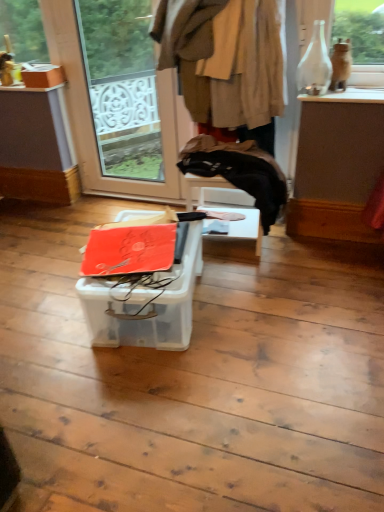
This screenshot has height=512, width=384. Describe the element at coordinates (42, 75) in the screenshot. I see `matte cardboard box at upper left, marked as the first cardboard box in a left-to-right arrangement` at that location.

Describe the element at coordinates (348, 96) in the screenshot. I see `white glossy vase at upper right` at that location.

Locate an element on the screen. orange matte cardboard box at center, the second cardboard box in the back-to-front sequence is located at coordinates (146, 300).

Is brown woolen coat at upper center not close to matte cardboard box at upper left, positioned as the 2th cardboard box in front-to-back order?

Yes, brown woolen coat at upper center and matte cardboard box at upper left, positioned as the 2th cardboard box in front-to-back order, are quite far apart.

From the image's perspective, is brown woolen coat at upper center below matte cardboard box at upper left, the 1th cardboard box in the back-to-front sequence?

Yes.

Considering the positions of points (213, 33) and (34, 73), is point (213, 33) farther from camera compared to point (34, 73)?

That is False.

Between brown woolen coat at upper center and matte cardboard box at upper left, marked as the first cardboard box in a left-to-right arrangement, which one appears on the left side from the viewer's perspective?

Positioned to the left is matte cardboard box at upper left, marked as the first cardboard box in a left-to-right arrangement.

Based on the photo, which object is wider, orange matte cardboard box at center, the second cardboard box in the back-to-front sequence, or white glossy vase at upper right?

orange matte cardboard box at center, the second cardboard box in the back-to-front sequence.

Is white glossy vase at upper right inside orange matte cardboard box at center, the second cardboard box viewed from the top?

No, white glossy vase at upper right is not surrounded by orange matte cardboard box at center, the second cardboard box viewed from the top.

Are orange matte cardboard box at center, positioned as the second cardboard box in left-to-right order, and white glossy vase at upper right far apart?

Yes, orange matte cardboard box at center, positioned as the second cardboard box in left-to-right order, and white glossy vase at upper right are located far from each other.

Is orange matte cardboard box at center, placed as the 1th cardboard box when sorted from right to left, oriented towards white glossy vase at upper right?

No, orange matte cardboard box at center, placed as the 1th cardboard box when sorted from right to left, is not oriented towards white glossy vase at upper right.

Which object is thinner, matte cardboard box at upper left, marked as the 2th cardboard box in a right-to-left arrangement, or brown woolen coat at upper center?

Thinner between the two is matte cardboard box at upper left, marked as the 2th cardboard box in a right-to-left arrangement.

From the image's perspective, between matte cardboard box at upper left, marked as the 1th cardboard box in a top-to-bottom arrangement, and brown woolen coat at upper center, who is located below?

brown woolen coat at upper center is shown below in the image.

Considering the positions of objects matte cardboard box at upper left, marked as the 1th cardboard box in a top-to-bottom arrangement, and brown woolen coat at upper center in the image provided, who is behind, matte cardboard box at upper left, marked as the 1th cardboard box in a top-to-bottom arrangement, or brown woolen coat at upper center?

Positioned behind is matte cardboard box at upper left, marked as the 1th cardboard box in a top-to-bottom arrangement.

Consider the image. Is matte cardboard box at upper left, positioned as the 2th cardboard box in front-to-back order, facing towards brown woolen coat at upper center?

No, matte cardboard box at upper left, positioned as the 2th cardboard box in front-to-back order, is not aimed at brown woolen coat at upper center.

Can you confirm if brown woolen coat at upper center is bigger than transparent glass door at upper left?

Correct, brown woolen coat at upper center is larger in size than transparent glass door at upper left.

Which object is wider, brown woolen coat at upper center or transparent glass door at upper left?

With larger width is brown woolen coat at upper center.

The height and width of the screenshot is (512, 384). Find the location of `clothing above the transparent glass door at upper left (from a real-world perspective)`. clothing above the transparent glass door at upper left (from a real-world perspective) is located at coordinates (224, 58).

How distant is brown woolen coat at upper center from transparent glass door at upper left?

A distance of 6.04 feet exists between brown woolen coat at upper center and transparent glass door at upper left.

Is transparent glass door at upper left in front of matte cardboard box at upper left, positioned as the 2th cardboard box in front-to-back order?

Yes, transparent glass door at upper left is closer to the camera.

In the scene shown: Looking at their sizes, would you say transparent glass door at upper left is wider or thinner than matte cardboard box at upper left, marked as the first cardboard box in a left-to-right arrangement?

Considering their sizes, transparent glass door at upper left looks slimmer than matte cardboard box at upper left, marked as the first cardboard box in a left-to-right arrangement.

Find the location of a particular element. cardboard box above the transparent glass door at upper left (from a real-world perspective) is located at coordinates (42, 75).

From a real-world perspective, is transparent glass door at upper left physically located above or below matte cardboard box at upper left, positioned as the 2th cardboard box in front-to-back order?

transparent glass door at upper left is below matte cardboard box at upper left, positioned as the 2th cardboard box in front-to-back order.

Where is `window sill in front of the transparent glass door at upper left`? window sill in front of the transparent glass door at upper left is located at coordinates (x=348, y=96).

Is white glossy vase at upper right not near transparent glass door at upper left?

Yes.

Could transparent glass door at upper left be considered to be inside white glossy vase at upper right?

No.

Does white glossy vase at upper right lie in front of transparent glass door at upper left?

That is True.

Considering the positions of objects transparent glass door at upper left and orange matte cardboard box at center, the second cardboard box in the back-to-front sequence, in the image provided, who is more to the left, transparent glass door at upper left or orange matte cardboard box at center, the second cardboard box in the back-to-front sequence,?

transparent glass door at upper left is more to the left.

Is transparent glass door at upper left not near orange matte cardboard box at center, which is the 1th cardboard box in bottom-to-top order?

Yes.

From the image's perspective, is transparent glass door at upper left above or below orange matte cardboard box at center, the second cardboard box viewed from the top?

transparent glass door at upper left is above orange matte cardboard box at center, the second cardboard box viewed from the top.

From a real-world perspective, is transparent glass door at upper left physically above orange matte cardboard box at center, acting as the first cardboard box starting from the front?

Yes, from a real-world perspective, transparent glass door at upper left is on top of orange matte cardboard box at center, acting as the first cardboard box starting from the front.

You are a GUI agent. You are given a task and a screenshot of the screen. Output one action in this format:
    pyautogui.click(x=<x>, y=<y>)
    Task: Click on the 2nd cardboard box to the left of the brown woolen coat at upper center, starting your count from the anchor
    
    Given the screenshot: What is the action you would take?
    pyautogui.click(x=42, y=75)

Locate an element on the screen. window sill lying behind the orange matte cardboard box at center, the second cardboard box viewed from the top is located at coordinates (348, 96).

Estimate the real-world distances between objects in this image. Which object is further from brown woolen coat at upper center, orange matte cardboard box at center, which is the 1th cardboard box in bottom-to-top order, or transparent glass door at upper left?

transparent glass door at upper left.

From the picture: Considering their positions, is orange matte cardboard box at center, which is the 1th cardboard box in bottom-to-top order, positioned further to brown woolen coat at upper center than white glossy vase at upper right?

The object further to brown woolen coat at upper center is orange matte cardboard box at center, which is the 1th cardboard box in bottom-to-top order.

From the image, which object appears to be nearer to matte cardboard box at upper left, marked as the first cardboard box in a left-to-right arrangement, white glossy vase at upper right or brown woolen coat at upper center?

brown woolen coat at upper center lies closer to matte cardboard box at upper left, marked as the first cardboard box in a left-to-right arrangement, than the other object.

Based on their spatial positions, is brown woolen coat at upper center or transparent glass door at upper left closer to matte cardboard box at upper left, positioned as the 2th cardboard box in front-to-back order?

brown woolen coat at upper center lies closer to matte cardboard box at upper left, positioned as the 2th cardboard box in front-to-back order, than the other object.

When comparing their distances from orange matte cardboard box at center, the second cardboard box in the back-to-front sequence, does matte cardboard box at upper left, marked as the 2th cardboard box in a right-to-left arrangement, or brown woolen coat at upper center seem closer?

brown woolen coat at upper center is positioned closer to the anchor orange matte cardboard box at center, the second cardboard box in the back-to-front sequence.

Which object lies further to the anchor point white glossy vase at upper right, brown woolen coat at upper center or orange matte cardboard box at center, the second cardboard box viewed from the top?

orange matte cardboard box at center, the second cardboard box viewed from the top, lies further to white glossy vase at upper right than the other object.

Which object lies nearer to the anchor point white glossy vase at upper right, matte cardboard box at upper left, positioned as the 2th cardboard box in front-to-back order, or orange matte cardboard box at center, which is the 1th cardboard box in bottom-to-top order?

orange matte cardboard box at center, which is the 1th cardboard box in bottom-to-top order, is positioned closer to the anchor white glossy vase at upper right.

Which object lies nearer to the anchor point brown woolen coat at upper center, transparent glass door at upper left or orange matte cardboard box at center, which is the 1th cardboard box in bottom-to-top order?

The object closer to brown woolen coat at upper center is orange matte cardboard box at center, which is the 1th cardboard box in bottom-to-top order.

In order to click on window sill between brown woolen coat at upper center and orange matte cardboard box at center, acting as the first cardboard box starting from the front, in the vertical direction in this screenshot , I will do `click(348, 96)`.

Find the location of a particular element. The width and height of the screenshot is (384, 512). window screen between matte cardboard box at upper left, the second cardboard box when ordered from bottom to top, and white glossy vase at upper right from left to right is located at coordinates (122, 86).

Locate an element on the screen. cardboard box between transparent glass door at upper left and white glossy vase at upper right in the horizontal direction is located at coordinates (146, 300).

Where is `cardboard box between matte cardboard box at upper left, the second cardboard box when ordered from bottom to top, and white glossy vase at upper right`? The width and height of the screenshot is (384, 512). cardboard box between matte cardboard box at upper left, the second cardboard box when ordered from bottom to top, and white glossy vase at upper right is located at coordinates 146,300.